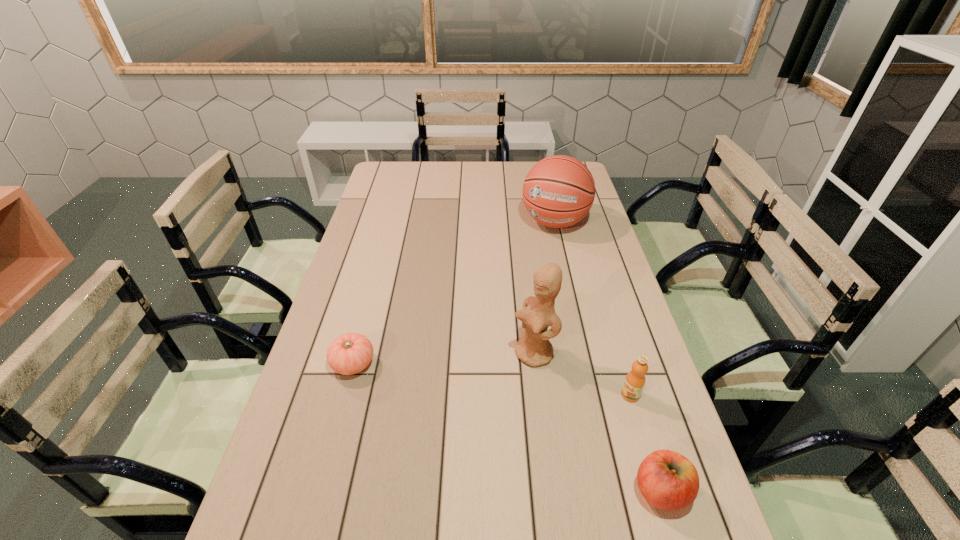
Identify the location of empty location between the third tallest object and the figurine. (582, 374).

The height and width of the screenshot is (540, 960). Identify the location of free space between the tomato and the second shortest object. (507, 428).

The image size is (960, 540). I want to click on vacant space in between the fourth farthest object and the shortest object, so click(492, 380).

Locate an element on the screen. Image resolution: width=960 pixels, height=540 pixels. blank region between the leftmost object and the figurine is located at coordinates (444, 359).

Locate an element on the screen. This screenshot has height=540, width=960. free space that is in between the farthest object and the orange juice is located at coordinates (592, 308).

Identify the location of free space between the farthest object and the apple. This screenshot has height=540, width=960. (608, 356).

Identify the location of unoccupied area between the orange juice and the farthest object. (592, 308).

Identify the location of empty location between the nearest object and the figurine. This screenshot has width=960, height=540. click(x=597, y=422).

Locate an element on the screen. free space between the orange juice and the figurine is located at coordinates (582, 374).

This screenshot has width=960, height=540. I want to click on object that ranks as the fourth closest to the tomato, so click(558, 191).